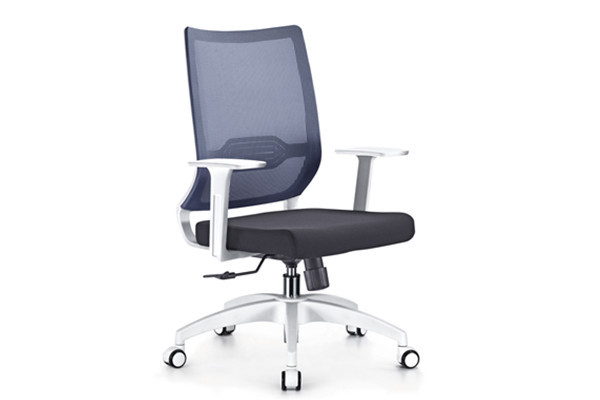
The image size is (600, 400). I want to click on 2 bars holding arm rests, so click(217, 196), click(363, 181).